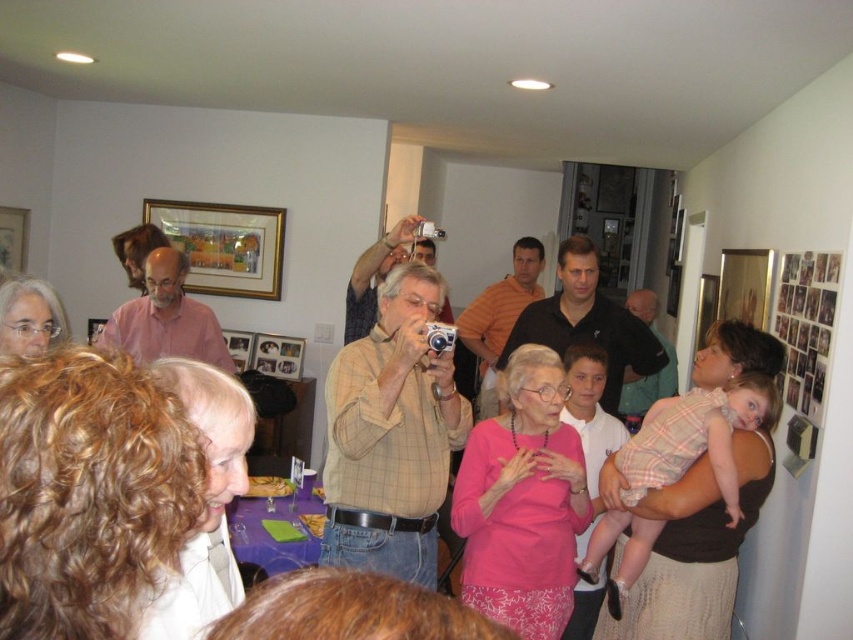
Question: Which object is positioned closest to the yellow checkered shirt at center?

Choices:
 (A) pink shirt at center
 (B) light brown shirt at center
 (C) white shirt at lower left
 (D) matte brown shirt at center

Answer: (C)

Question: Which of the following is the closest to the observer?

Choices:
 (A) black shirt at center
 (B) light brown shirt at center

Answer: (A)

Question: Can you confirm if white shirt at lower left is bigger than orange shirt at center?

Choices:
 (A) yes
 (B) no

Answer: (B)

Question: Is white shirt at lower left smaller than orange shirt at center?

Choices:
 (A) no
 (B) yes

Answer: (B)

Question: Does yellow checkered shirt at center appear over matte pink blouse at center?

Choices:
 (A) no
 (B) yes

Answer: (B)

Question: Which of the following is the closest to the observer?

Choices:
 (A) (543, 312)
 (B) (114, 312)

Answer: (B)